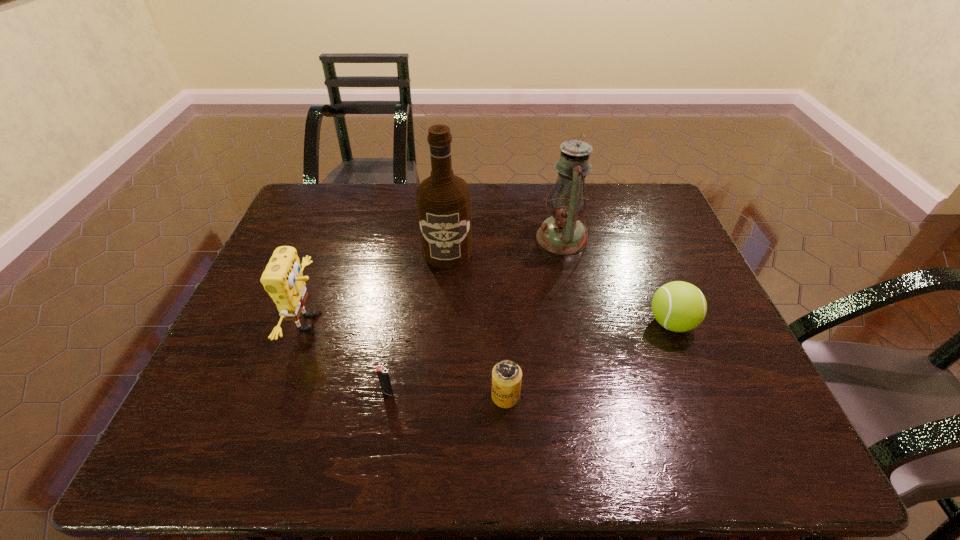
Where is `vacant point that satisfies the following two spatial constraints: 1. on the label of the alcohol; 2. on the left side of the beer can`? The image size is (960, 540). vacant point that satisfies the following two spatial constraints: 1. on the label of the alcohol; 2. on the left side of the beer can is located at coordinates (436, 396).